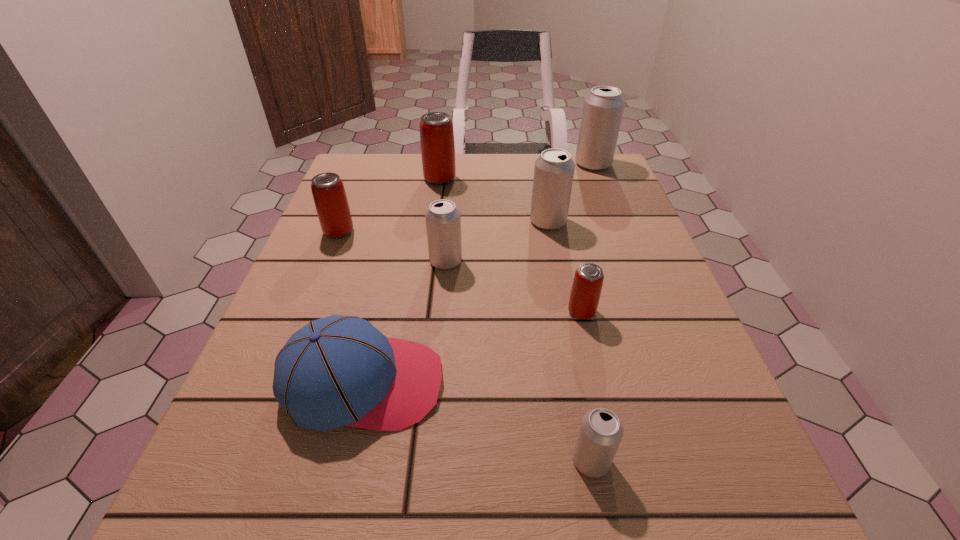
Find the location of `free space at the far right corner of the desktop`. free space at the far right corner of the desktop is located at coordinates (575, 156).

The width and height of the screenshot is (960, 540). What are the coordinates of `free area in between the smallest pink beer can and the tallest object` in the screenshot? It's located at (588, 238).

This screenshot has width=960, height=540. What are the coordinates of `empty location between the sixth farthest object and the second biggest white beer can` in the screenshot? It's located at (564, 267).

The width and height of the screenshot is (960, 540). Identify the location of empty location between the blue baseball cap and the second nearest beer can. (472, 347).

Locate an element on the screen. vacant space that is in between the second nearest white beer can and the second farthest white beer can is located at coordinates (497, 241).

In order to click on free space between the third farthest white beer can and the nearest pink beer can in this screenshot , I will do `click(514, 286)`.

Image resolution: width=960 pixels, height=540 pixels. I want to click on vacant area that lies between the tallest object and the leftmost beer can, so click(x=466, y=198).

Where is `empty space between the fifth farthest beer can and the biggest white beer can`? The width and height of the screenshot is (960, 540). empty space between the fifth farthest beer can and the biggest white beer can is located at coordinates (519, 212).

The width and height of the screenshot is (960, 540). I want to click on vacant area that lies between the third smallest white beer can and the smallest pink beer can, so click(564, 267).

The image size is (960, 540). What are the coordinates of `vacant area that lies between the seventh farthest object and the farthest pink beer can` in the screenshot? It's located at (401, 281).